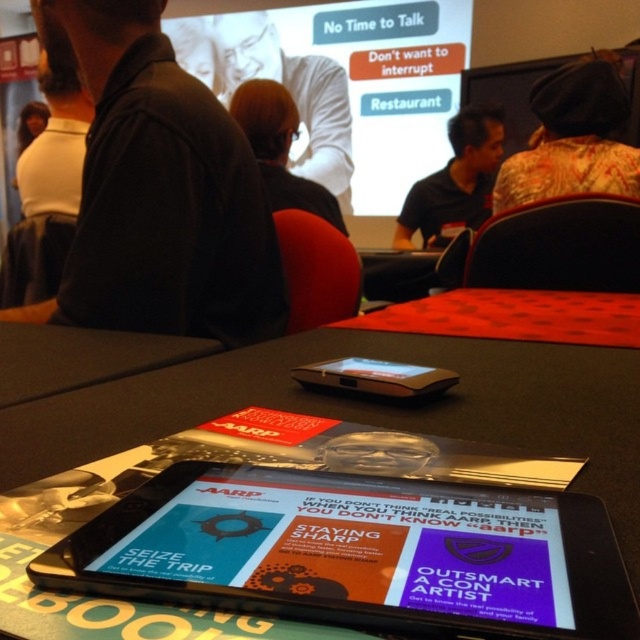
Looking at this image, you are an attendee at the conference and want to pick up the black plastic tablet at center without touching the blonde hair at center. Is this possible?

The blonde hair at center is located above the black plastic tablet at center, so you can carefully reach under the hair to pick up the tablet without touching it.